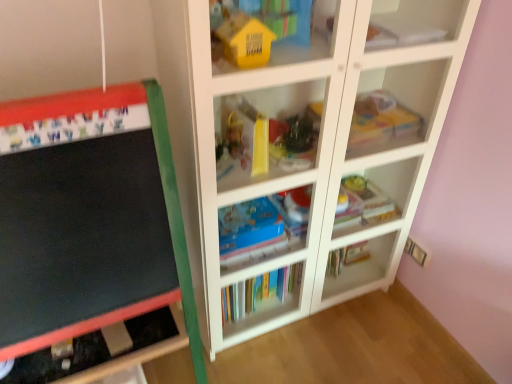
What do you see at coordinates (315, 152) in the screenshot?
I see `white glossy bookshelf at center, the 2th shelf ordered from the bottom` at bounding box center [315, 152].

In order to face white glossy bookshelf at center, which is counted as the 1th shelf, starting from the top, should I rotate leftwards or rightwards?

To face it directly, rotate right by 6.703 degrees.

Image resolution: width=512 pixels, height=384 pixels. I want to click on multicolored paperbacks at center, the third book viewed from the top, so click(x=260, y=292).

Describe the element at coordinates (381, 119) in the screenshot. I see `translucent plastic toy at upper right, which is counted as the 1th toy, starting from the back` at that location.

Measure the distance between blue cardboard book at center, the 1th shelf in the bottom-to-top sequence, and camera.

They are 4.30 feet apart.

Measure the distance between yellow matte house at upper center, marked as the third toy in a back-to-front arrangement, and camera.

yellow matte house at upper center, marked as the third toy in a back-to-front arrangement, is 37.36 inches from camera.

What do you see at coordinates (245, 40) in the screenshot? I see `yellow matte house at upper center, positioned as the first toy in front-to-back order` at bounding box center [245, 40].

At what (x,y) coordinates should I click in order to perform the action: click on white glossy bookshelf at center, which is counted as the 1th shelf, starting from the top. Please return your answer as a coordinate pair (x, y). Looking at the image, I should click on pyautogui.click(x=315, y=152).

From the image's perspective, which object appears higher, multicolored paperbacks at center, the third book viewed from the top, or white glossy bookshelf at center, the 2th shelf ordered from the bottom?

white glossy bookshelf at center, the 2th shelf ordered from the bottom, is shown above in the image.

Identify the location of the 2nd book below the white glossy bookshelf at center, which is counted as the 1th shelf, starting from the top (from the image's perspective). The image size is (512, 384). (260, 292).

Is white glossy bookshelf at center, which is counted as the 1th shelf, starting from the top, completely or partially inside multicolored paperbacks at center, the third book viewed from the top?

No, white glossy bookshelf at center, which is counted as the 1th shelf, starting from the top, is not surrounded by multicolored paperbacks at center, the third book viewed from the top.

Can you confirm if multicolored paperbacks at center, the third book viewed from the top, is taller than white glossy bookshelf at center, the 2th shelf ordered from the bottom?

No.

Is white paper at upper right, which ranks as the 1th book in top-to-bottom order, wider or thinner than multicolored paperbacks at center, the third book viewed from the top?

In the image, white paper at upper right, which ranks as the 1th book in top-to-bottom order, appears to be wider than multicolored paperbacks at center, the third book viewed from the top.

Is white paper at upper right, which ranks as the 1th book in top-to-bottom order, oriented away from multicolored paperbacks at center, the third book viewed from the top?

white paper at upper right, which ranks as the 1th book in top-to-bottom order, does not have its back to multicolored paperbacks at center, the third book viewed from the top.

Which is behind, point (408, 36) or point (259, 293)?

The point (259, 293) is more distant.

Can you tell me how much white paper at upper right, which ranks as the 1th book in top-to-bottom order, and matte blue book at center, which is the 2th book from top to bottom, differ in facing direction?

white paper at upper right, which ranks as the 1th book in top-to-bottom order, and matte blue book at center, which is the 2th book from top to bottom, are facing 1.1 degrees away from each other.

From a real-world perspective, is white paper at upper right, which ranks as the 1th book in top-to-bottom order, on matte blue book at center, the 2th book from the bottom?

Yes, from a real-world perspective, white paper at upper right, which ranks as the 1th book in top-to-bottom order, is on top of matte blue book at center, the 2th book from the bottom.

Considering the sizes of objects white paper at upper right, which is the 3th book in bottom-to-top order, and matte blue book at center, the 2th book from the bottom, in the image provided, who is thinner, white paper at upper right, which is the 3th book in bottom-to-top order, or matte blue book at center, the 2th book from the bottom,?

With smaller width is white paper at upper right, which is the 3th book in bottom-to-top order.

Measure the distance from matte blue book at center, which is the 2th book from top to bottom, to white paper at upper right, which is the 3th book in bottom-to-top order.

A distance of 23.46 inches exists between matte blue book at center, which is the 2th book from top to bottom, and white paper at upper right, which is the 3th book in bottom-to-top order.

Can you confirm if matte blue book at center, the 2th book from the bottom, is wider than white paper at upper right, which ranks as the 1th book in top-to-bottom order?

Correct, the width of matte blue book at center, the 2th book from the bottom, exceeds that of white paper at upper right, which ranks as the 1th book in top-to-bottom order.

Looking at this image, from a real-world perspective, is matte blue book at center, the 2th book from the bottom, positioned under white paper at upper right, which ranks as the 1th book in top-to-bottom order, based on gravity?

Yes.

Considering the sizes of matte blue book at center, which is the 2th book from top to bottom, and white paper at upper right, which ranks as the 1th book in top-to-bottom order, in the image, is matte blue book at center, which is the 2th book from top to bottom, taller or shorter than white paper at upper right, which ranks as the 1th book in top-to-bottom order,?

Clearly, matte blue book at center, which is the 2th book from top to bottom, is taller compared to white paper at upper right, which ranks as the 1th book in top-to-bottom order.

From a real-world perspective, does yellow matte house at upper center, which is counted as the third toy, starting from the right, stand above shiny plastic toy at center, which is the 2th toy in right-to-left order?

Yes.

Consider the image. From the image's perspective, between yellow matte house at upper center, positioned as the first toy in front-to-back order, and shiny plastic toy at center, the 2th toy from the front, who is located below?

shiny plastic toy at center, the 2th toy from the front, from the image's perspective.

Which object is more forward, yellow matte house at upper center, positioned as the first toy in front-to-back order, or shiny plastic toy at center, the second toy in the left-to-right sequence?

yellow matte house at upper center, positioned as the first toy in front-to-back order.

In the scene shown: Which of these two, yellow matte house at upper center, marked as the third toy in a back-to-front arrangement, or shiny plastic toy at center, the 2th toy from the front, is wider?

shiny plastic toy at center, the 2th toy from the front, is wider.

Which object is positioned more to the left, white glossy bookshelf at center, the 2th shelf ordered from the bottom, or shiny plastic toy at center, the second toy when ordered from back to front?

Positioned to the left is shiny plastic toy at center, the second toy when ordered from back to front.

Is white glossy bookshelf at center, which is counted as the 1th shelf, starting from the top, looking in the opposite direction of shiny plastic toy at center, the second toy when ordered from back to front?

Yes, white glossy bookshelf at center, which is counted as the 1th shelf, starting from the top, is facing away from shiny plastic toy at center, the second toy when ordered from back to front.

The width and height of the screenshot is (512, 384). I want to click on shelf in front of the shiny plastic toy at center, the second toy in the left-to-right sequence, so click(315, 152).

Which of these two, white glossy bookshelf at center, which is counted as the 1th shelf, starting from the top, or shiny plastic toy at center, the second toy when ordered from back to front, stands shorter?

shiny plastic toy at center, the second toy when ordered from back to front, is shorter.

Considering the sizes of objects matte blue book at center, the 2th book from the bottom, and translucent plastic toy at upper right, the third toy viewed from the front, in the image provided, who is bigger, matte blue book at center, the 2th book from the bottom, or translucent plastic toy at upper right, the third toy viewed from the front,?

Bigger between the two is matte blue book at center, the 2th book from the bottom.

Would you say matte blue book at center, the 2th book from the bottom, is inside or outside translucent plastic toy at upper right, the 3th toy positioned from the left?

The correct answer is: outside.

Based on the photo, are matte blue book at center, the 2th book from the bottom, and translucent plastic toy at upper right, the 3th toy positioned from the left, located far from each other?

No, matte blue book at center, the 2th book from the bottom, is not far from translucent plastic toy at upper right, the 3th toy positioned from the left.

At what (x,y) coordinates should I click in order to perform the action: click on the 1st book directly beneath the translucent plastic toy at upper right, the third toy viewed from the front (from a real-world perspective). Please return your answer as a coordinate pair (x, y). This screenshot has width=512, height=384. Looking at the image, I should click on (362, 203).

At what (x,y) coordinates should I click in order to perform the action: click on the 2nd shelf positioned above the multicolored paperbacks at center, arranged as the 1th book when ordered from the bottom (from the image's perspective). Please return your answer as a coordinate pair (x, y). Image resolution: width=512 pixels, height=384 pixels. Looking at the image, I should click on (315, 152).

Locate an element on the screen. the 1st book behind the white paper at upper right, which is the 3th book in bottom-to-top order is located at coordinates (260, 292).

Considering their positions, is white glossy bookshelf at center, which is counted as the 1th shelf, starting from the top, positioned closer to white paper at upper right, which is the 3th book in bottom-to-top order, than yellow matte house at upper center, placed as the first toy when sorted from left to right?

yellow matte house at upper center, placed as the first toy when sorted from left to right.

Estimate the real-world distances between objects in this image. Which object is further from blue cardboard book at center, the 1th shelf in the bottom-to-top sequence, white paper at upper right, which ranks as the 1th book in top-to-bottom order, or shiny plastic toy at center, the second toy in the left-to-right sequence?

The object further to blue cardboard book at center, the 1th shelf in the bottom-to-top sequence, is white paper at upper right, which ranks as the 1th book in top-to-bottom order.

From the image, which object appears to be farther from matte blue book at center, the 2th book from the bottom, multicolored paperbacks at center, the third book viewed from the top, or white paper at upper right, which ranks as the 1th book in top-to-bottom order?

white paper at upper right, which ranks as the 1th book in top-to-bottom order, lies further to matte blue book at center, the 2th book from the bottom, than the other object.

From the picture: Considering their positions, is translucent plastic toy at upper right, the 3th toy positioned from the left, positioned further to multicolored paperbacks at center, the third book viewed from the top, than white glossy bookshelf at center, which is counted as the 1th shelf, starting from the top?

translucent plastic toy at upper right, the 3th toy positioned from the left, lies further to multicolored paperbacks at center, the third book viewed from the top, than the other object.

Estimate the real-world distances between objects in this image. Which object is further from shiny plastic toy at center, which is the 2th toy in right-to-left order, white glossy bookshelf at center, the 2th shelf ordered from the bottom, or yellow matte house at upper center, marked as the third toy in a back-to-front arrangement?

Among the two, yellow matte house at upper center, marked as the third toy in a back-to-front arrangement, is located further to shiny plastic toy at center, which is the 2th toy in right-to-left order.

From the image, which object appears to be nearer to translucent plastic toy at upper right, acting as the 1th toy starting from the right, shiny plastic toy at center, the 2th toy from the front, or white glossy bookshelf at center, the 2th shelf ordered from the bottom?

Based on the image, shiny plastic toy at center, the 2th toy from the front, appears to be nearer to translucent plastic toy at upper right, acting as the 1th toy starting from the right.

Looking at the image, which one is located further to white paper at upper right, which is the 3th book in bottom-to-top order, matte blue book at center, the 2th book from the bottom, or translucent plastic toy at upper right, the third toy viewed from the front?

matte blue book at center, the 2th book from the bottom.

Based on their spatial positions, is blue cardboard book at center, placed as the 2th shelf when sorted from top to bottom, or translucent plastic toy at upper right, acting as the 1th toy starting from the right, further from shiny plastic toy at center, the 2th toy from the front?

blue cardboard book at center, placed as the 2th shelf when sorted from top to bottom, is further to shiny plastic toy at center, the 2th toy from the front.

Find the location of a particular element. The width and height of the screenshot is (512, 384). book that lies between shiny plastic toy at center, the second toy when ordered from back to front, and multicolored paperbacks at center, arranged as the 1th book when ordered from the bottom, from top to bottom is located at coordinates (362, 203).

Image resolution: width=512 pixels, height=384 pixels. In order to click on toy located between white glossy bookshelf at center, the 2th shelf ordered from the bottom, and shiny plastic toy at center, the second toy in the left-to-right sequence, in the depth direction in this screenshot , I will do `click(245, 40)`.

You are a GUI agent. You are given a task and a screenshot of the screen. Output one action in this format:
    pyautogui.click(x=<x>, y=<y>)
    Task: Click on the shelf positioned between white glossy bookshelf at center, which is counted as the 1th shelf, starting from the top, and multicolored paperbacks at center, the third book viewed from the top, from near to far
    The image size is (512, 384).
    Given the screenshot: What is the action you would take?
    pyautogui.click(x=258, y=229)

The image size is (512, 384). I want to click on book between white paper at upper right, which ranks as the 1th book in top-to-bottom order, and multicolored paperbacks at center, arranged as the 1th book when ordered from the bottom, from top to bottom, so click(x=362, y=203).